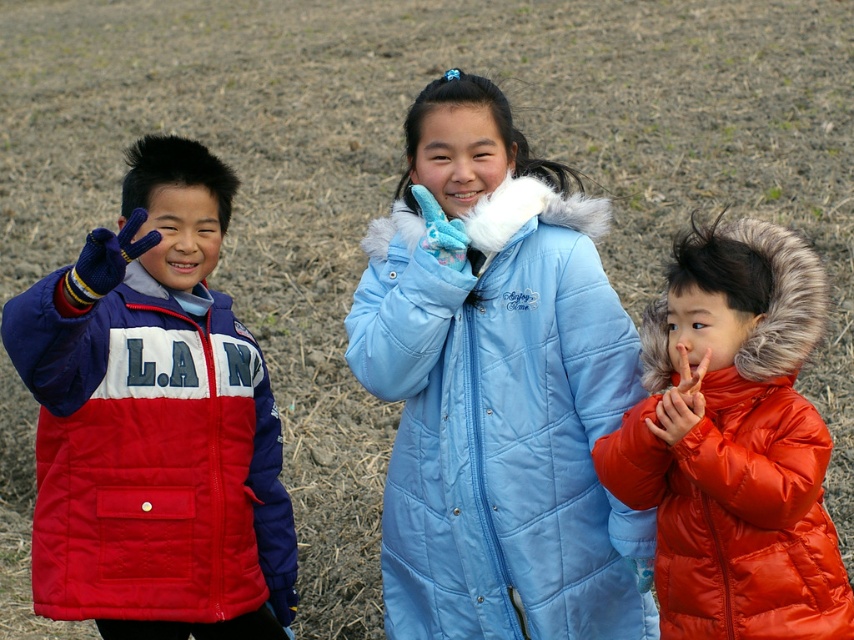
You are a photographer trying to capture the shiny orange puffer jacket at right and the matte orange glove at lower right in a single frame. Given their sizes, which object will appear bigger in the photo?

The shiny orange puffer jacket at right will appear bigger in the photo because it has a larger size compared to the matte orange glove at lower right.

From the picture: You are a photographer trying to capture a closeup of the matte orange glove at lower right without including the matte nylon jacket at left in the frame. Given their relative sizes, is this possible?

The matte nylon jacket at left has a greater height compared to the matte orange glove at lower right. Since the jacket is taller, it might block the view of the glove unless you adjust your angle or move closer to the glove while ensuring the jacket is out of the frame.